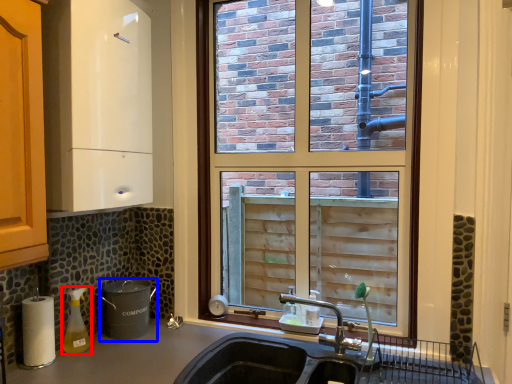
Question: Which object appears closest to the camera in this image, bottle (highlighted by a red box) or appliance (highlighted by a blue box)?

Choices:
 (A) bottle
 (B) appliance

Answer: (A)